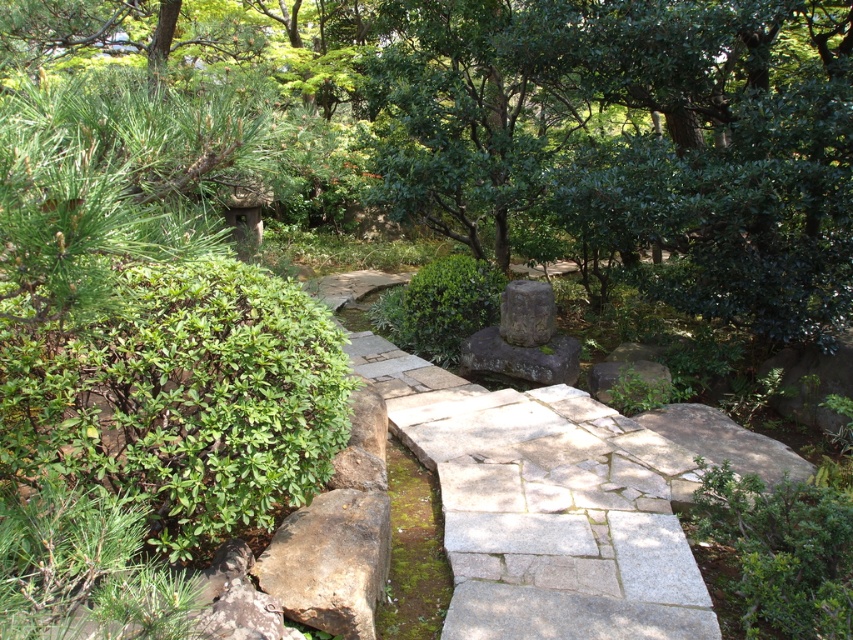
Question: Does green leafy bush at center lie behind gray stone at center?

Choices:
 (A) no
 (B) yes

Answer: (B)

Question: Which point is closer to the camera taking this photo?

Choices:
 (A) (450, 324)
 (B) (165, 506)

Answer: (B)

Question: Which of the following is the farthest from the observer?

Choices:
 (A) green leafy bush at lower right
 (B) green leafy bush at center
 (C) green leafy bush at left

Answer: (B)

Question: Is green leafy bush at left below green leafy bush at center?

Choices:
 (A) yes
 (B) no

Answer: (A)

Question: Which is farther from the green leafy bush at left?

Choices:
 (A) green leafy bush at center
 (B) gray stone at center

Answer: (A)

Question: In this image, where is green leafy bush at lower right located relative to green leafy bush at center?

Choices:
 (A) left
 (B) right

Answer: (B)